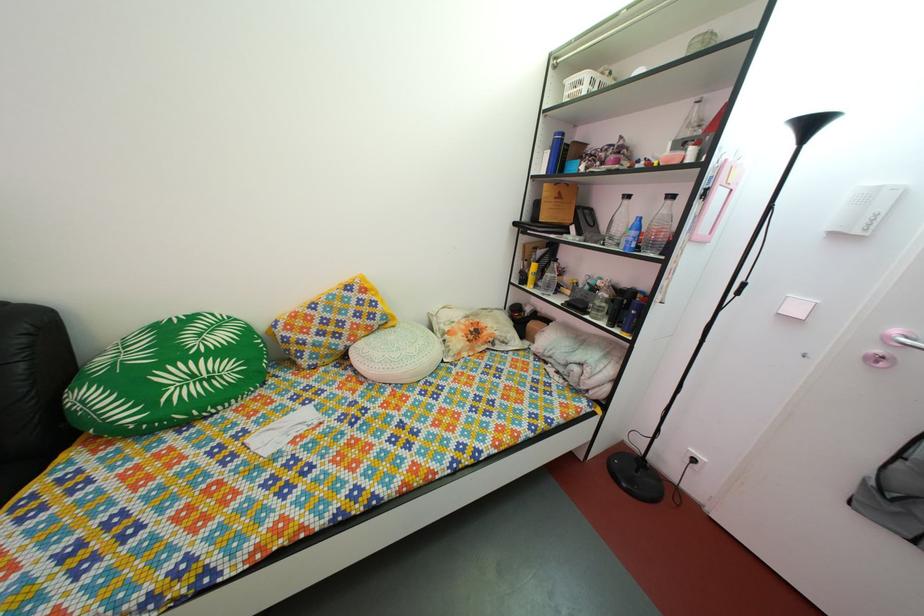
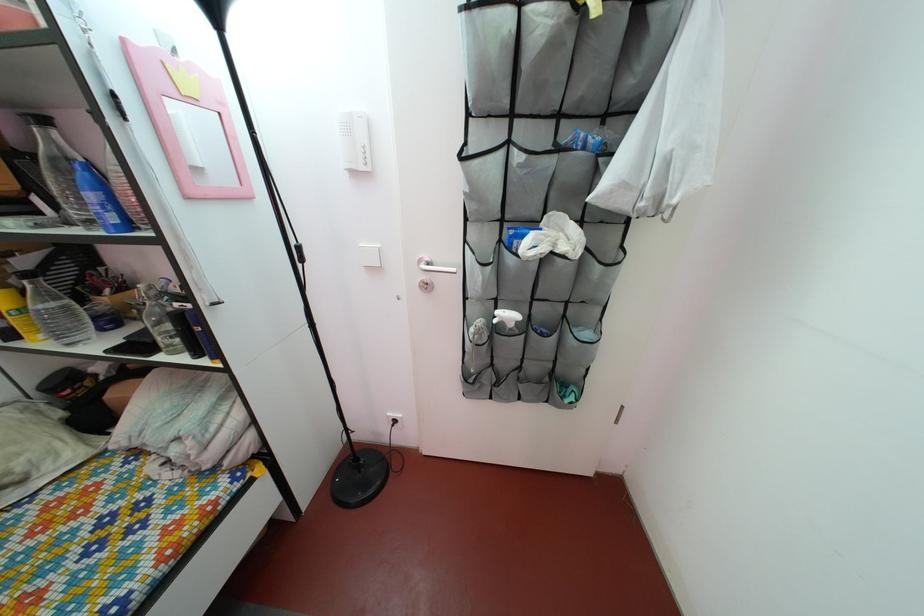
In the second image, find the point that corresponds to the point at 549,261 in the first image.

(32, 270)